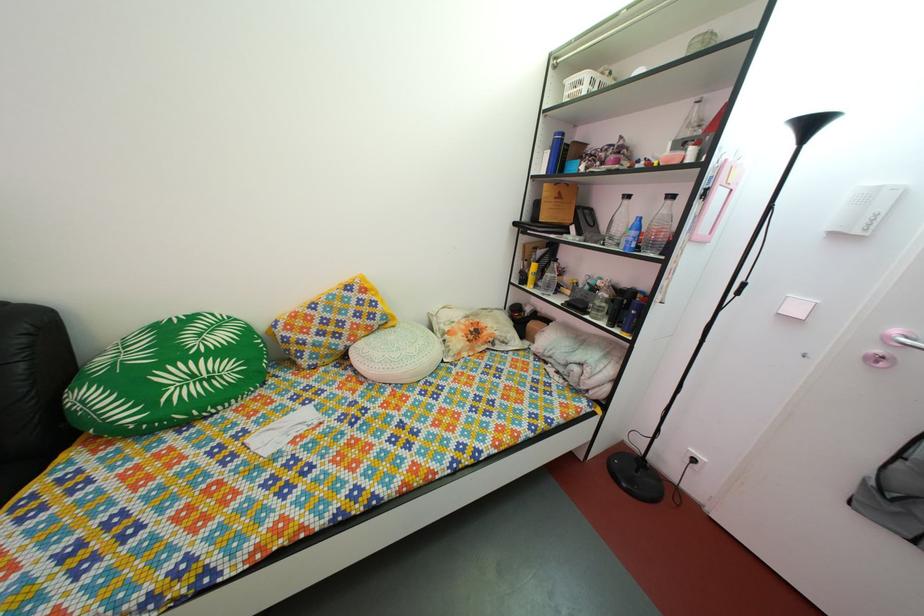
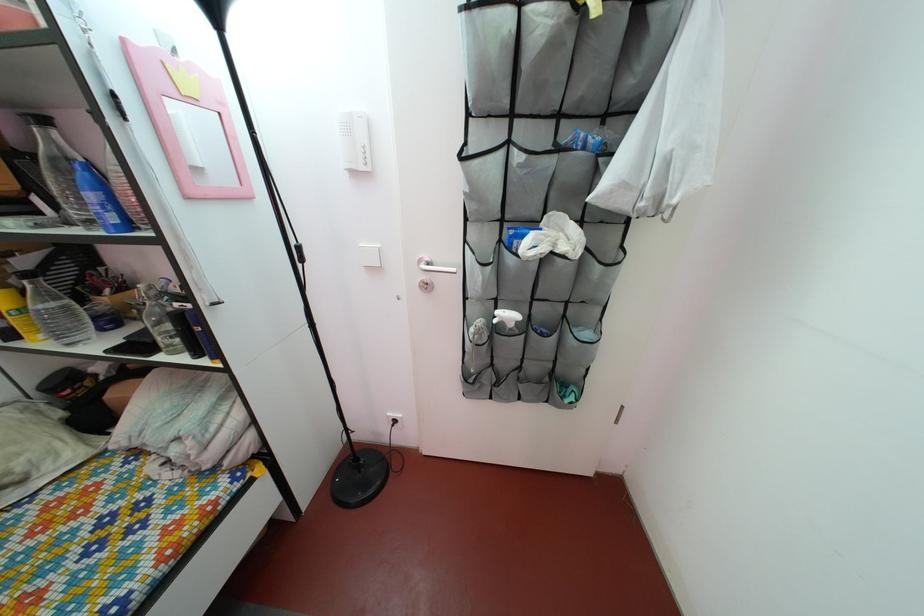
In the second image, find the point that corresponds to the point at 549,261 in the first image.

(32, 270)